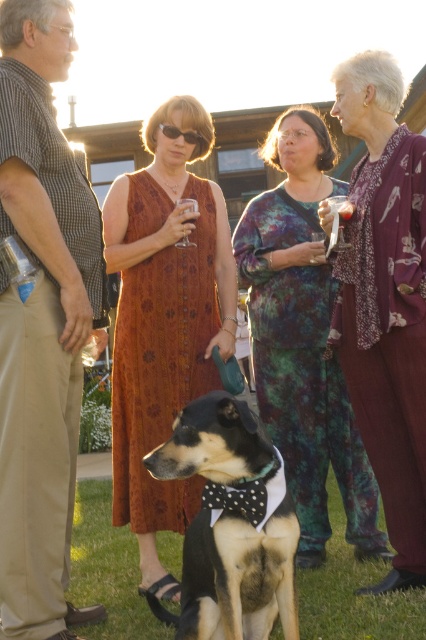
You are a photographer standing at the edge of the gathering. You want to take a photo that includes both the khaki cotton pants at center and the clear glass wine glass at center. Based on their positions, can you fit both into the frame without moving either object?

The khaki cotton pants at center and clear glass wine glass at center are 3.68 feet apart from each other. Since the distance between them is manageable for a standard camera frame, you can likely fit both into the photo without needing to adjust their positions.

You are a photographer at the event and want to capture a photo of the khaki cotton pants at center and the clear glass wine glass at center. If you want to ensure both objects are in focus, which object should you adjust your camera focus on first?

The khaki cotton pants at center has a larger size compared to clear glass wine glass at center, so you should focus on the khaki cotton pants at center first to ensure both are in focus.